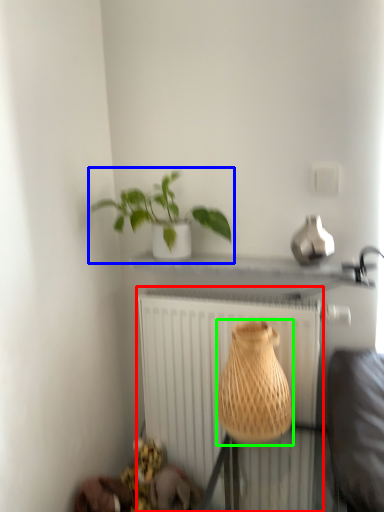
Question: Estimate the real-world distances between objects in this image. Which object is closer to radiator (highlighted by a red box), houseplant (highlighted by a blue box) or vase (highlighted by a green box)?

Choices:
 (A) houseplant
 (B) vase

Answer: (B)